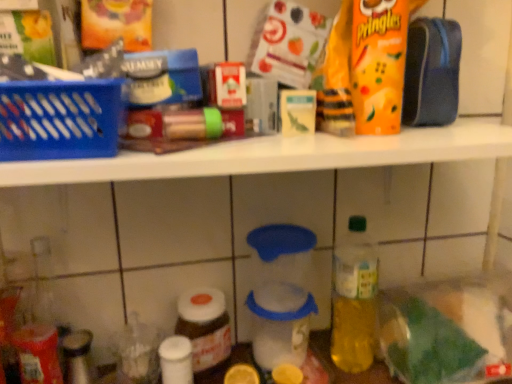
Question: Is yellow matte lemon at lower center, the 1th lemon positioned from the right, not near orange matte pringles at upper right?

Choices:
 (A) yes
 (B) no

Answer: (B)

Question: Can you confirm if yellow matte lemon at lower center, which is counted as the second lemon, starting from the left, is taller than orange matte pringles at upper right?

Choices:
 (A) yes
 (B) no

Answer: (B)

Question: Is yellow matte lemon at lower center, which is counted as the second lemon, starting from the left, shorter than orange matte pringles at upper right?

Choices:
 (A) no
 (B) yes

Answer: (B)

Question: From the image's perspective, would you say yellow matte lemon at lower center, which is counted as the second lemon, starting from the left, is shown under orange matte pringles at upper right?

Choices:
 (A) yes
 (B) no

Answer: (A)

Question: Does yellow matte lemon at lower center, which is counted as the second lemon, starting from the left, appear on the left side of orange matte pringles at upper right?

Choices:
 (A) no
 (B) yes

Answer: (B)

Question: Relative to translucent plastic container at lower left, arranged as the third bottle when viewed from the right, is matte brown jar at lower left, which is counted as the 2th bottle, starting from the right, in front or behind?

Choices:
 (A) behind
 (B) front

Answer: (A)

Question: Choose the correct answer: Is matte brown jar at lower left, which is counted as the 2th bottle, starting from the right, inside translucent plastic container at lower left, arranged as the third bottle when viewed from the right, or outside it?

Choices:
 (A) inside
 (B) outside

Answer: (B)

Question: From the image's perspective, relative to translucent plastic container at lower left, arranged as the third bottle when viewed from the right, is matte brown jar at lower left, which is counted as the 2th bottle, starting from the right, above or below?

Choices:
 (A) below
 (B) above

Answer: (B)

Question: Considering the positions of point [211, 370] and point [145, 339], is point [211, 370] closer or farther from the camera than point [145, 339]?

Choices:
 (A) closer
 (B) farther

Answer: (A)

Question: Is point (367, 258) positioned closer to the camera than point (183, 324)?

Choices:
 (A) closer
 (B) farther

Answer: (B)

Question: Based on their positions, is green plastic bottle at center-right, positioned as the 3th bottle in left-to-right order, located to the left or right of matte brown jar at lower left, which is counted as the 2th bottle, starting from the left?

Choices:
 (A) left
 (B) right

Answer: (B)

Question: Do you think green plastic bottle at center-right, positioned as the 3th bottle in left-to-right order, is within matte brown jar at lower left, which is counted as the 2th bottle, starting from the right, or outside of it?

Choices:
 (A) inside
 (B) outside

Answer: (B)

Question: From a real-world perspective, is green plastic bottle at center-right, which appears as the 1th bottle when viewed from the right, above or below matte brown jar at lower left, which is counted as the 2th bottle, starting from the right?

Choices:
 (A) above
 (B) below

Answer: (A)

Question: From the image's perspective, is yellow matte lemon at lower center, arranged as the first lemon when viewed from the left, located above or below blue plastic basket at left?

Choices:
 (A) below
 (B) above

Answer: (A)

Question: Is yellow matte lemon at lower center, acting as the second lemon starting from the right, inside the boundaries of blue plastic basket at left, or outside?

Choices:
 (A) outside
 (B) inside

Answer: (A)